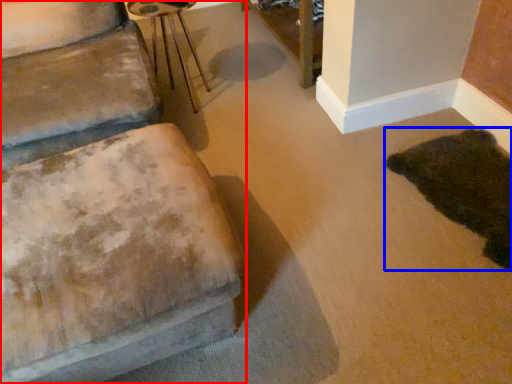
Question: Among these objects, which one is nearest to the camera, furniture (highlighted by a red box) or animal (highlighted by a blue box)?

Choices:
 (A) furniture
 (B) animal

Answer: (A)